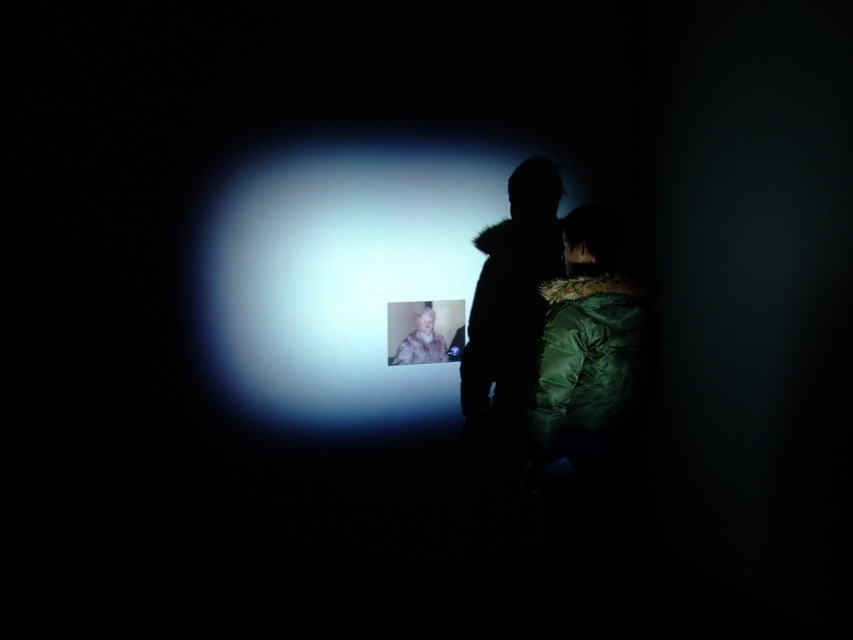
Question: Is dark fur coat at center bigger than green down jacket at center?

Choices:
 (A) no
 (B) yes

Answer: (B)

Question: Is green down jacket at center to the left of white fur coat at center from the viewer's perspective?

Choices:
 (A) yes
 (B) no

Answer: (B)

Question: Which of the following is the farthest from the observer?

Choices:
 (A) (488, 371)
 (B) (512, 364)
 (C) (408, 337)

Answer: (B)

Question: Among these objects, which one is nearest to the camera?

Choices:
 (A) dark fur coat at center
 (B) green down jacket at center

Answer: (A)

Question: Can you confirm if green down jacket at center is smaller than white fur coat at center?

Choices:
 (A) yes
 (B) no

Answer: (B)

Question: Which of the following is the closest to the observer?

Choices:
 (A) (433, 333)
 (B) (480, 289)
 (C) (556, 188)

Answer: (A)